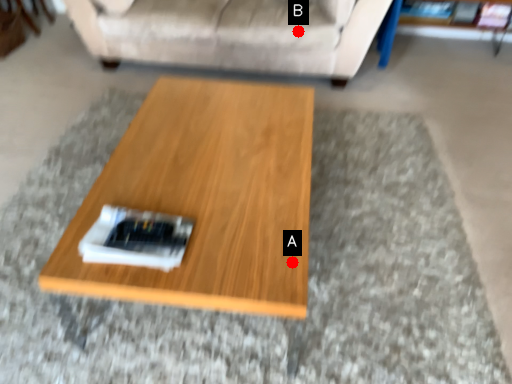
Question: Two points are circled on the image, labeled by A and B beside each circle. Which point appears closest to the camera in this image?

Choices:
 (A) A is closer
 (B) B is closer

Answer: (A)